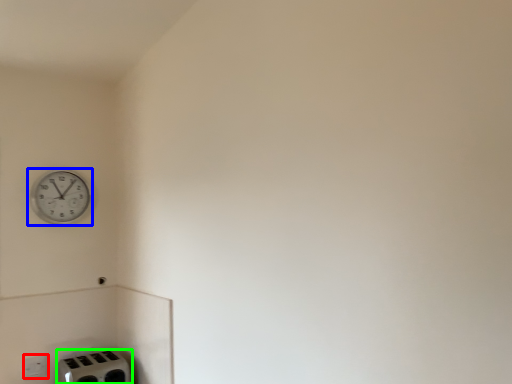
Question: Considering the real-world distances, which object is farthest from electric outlet (highlighted by a red box)? wall clock (highlighted by a blue box) or appliance (highlighted by a green box)?

Choices:
 (A) wall clock
 (B) appliance

Answer: (A)